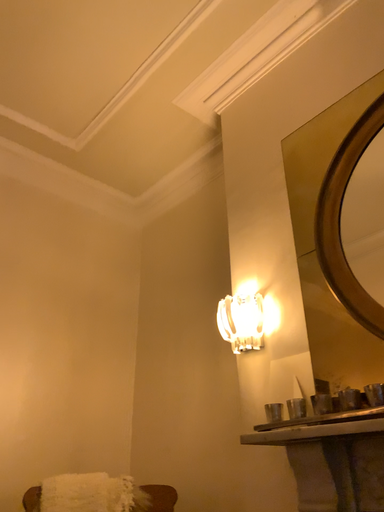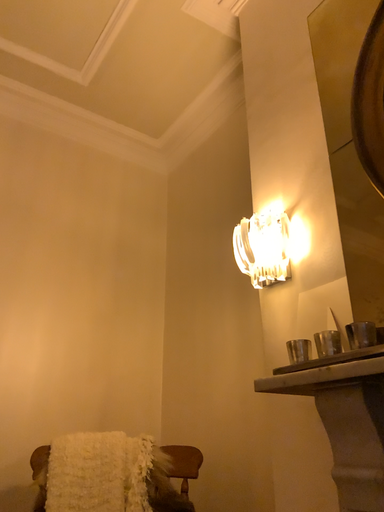
Question: Which way did the camera rotate in the video?

Choices:
 (A) rotated right
 (B) rotated left

Answer: (B)